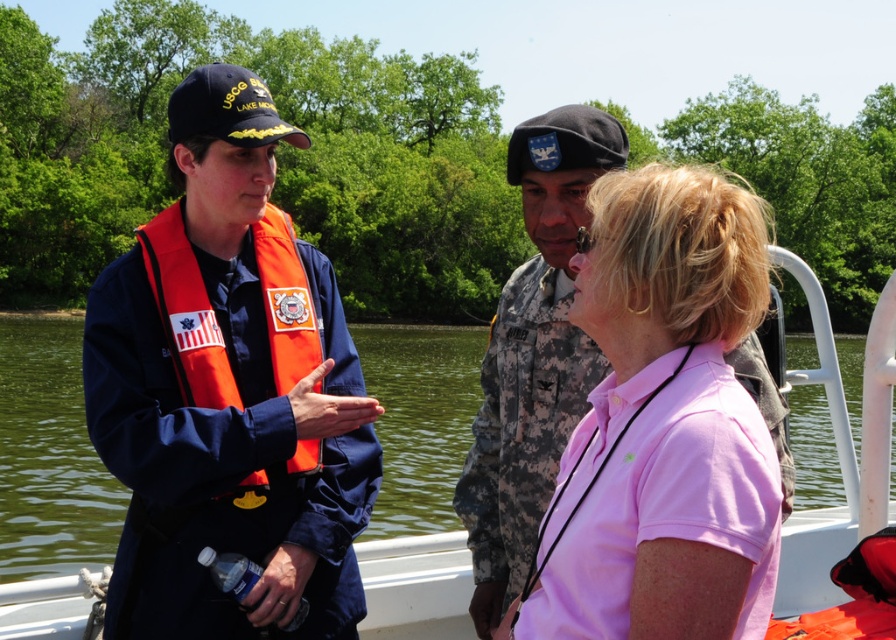
Question: Is navy blue uniform at center smaller than pink cotton polo shirt at center?

Choices:
 (A) yes
 (B) no

Answer: (A)

Question: Which object appears closest to the camera in this image?

Choices:
 (A) pink cotton polo shirt at center
 (B) navy blue uniform at center

Answer: (A)

Question: Considering the real-world distances, which object is farthest from the navy blue uniform at center?

Choices:
 (A) orange fabric life jacket at left
 (B) pink cotton polo shirt at center

Answer: (B)

Question: Which object is the closest to the orange fabric life jacket at left?

Choices:
 (A) pink cotton polo shirt at center
 (B) navy blue uniform at center

Answer: (B)

Question: Is navy blue uniform at center positioned at the back of pink cotton polo shirt at center?

Choices:
 (A) no
 (B) yes

Answer: (B)

Question: Is navy blue uniform at center below orange fabric life jacket at left?

Choices:
 (A) no
 (B) yes

Answer: (B)